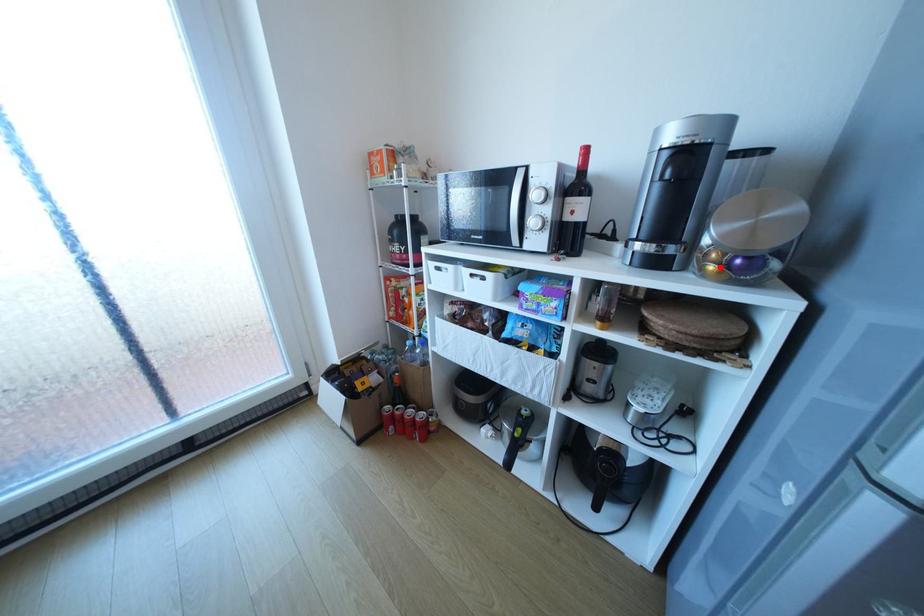
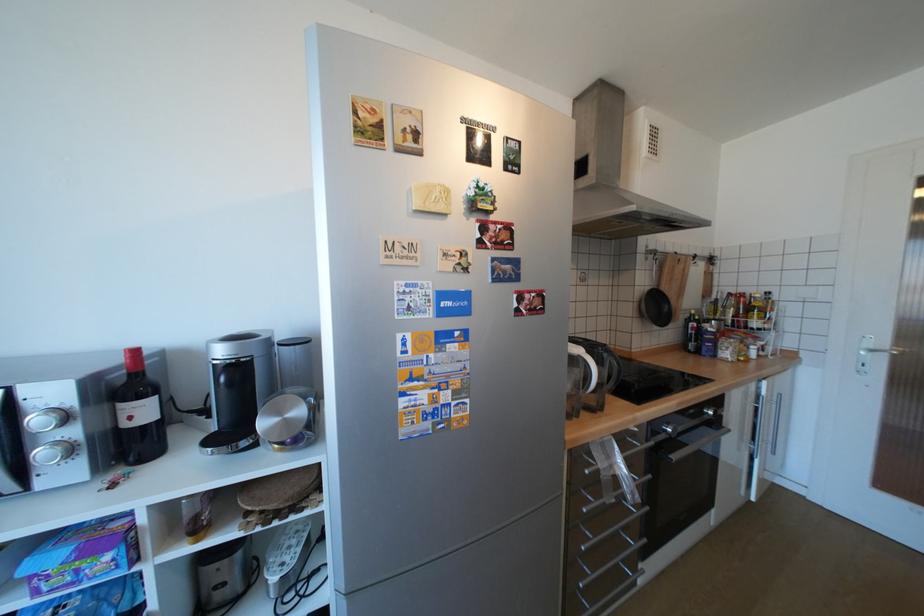
The point at the highlighted location is marked in the first image. Where is the corresponding point in the second image?

(286, 446)